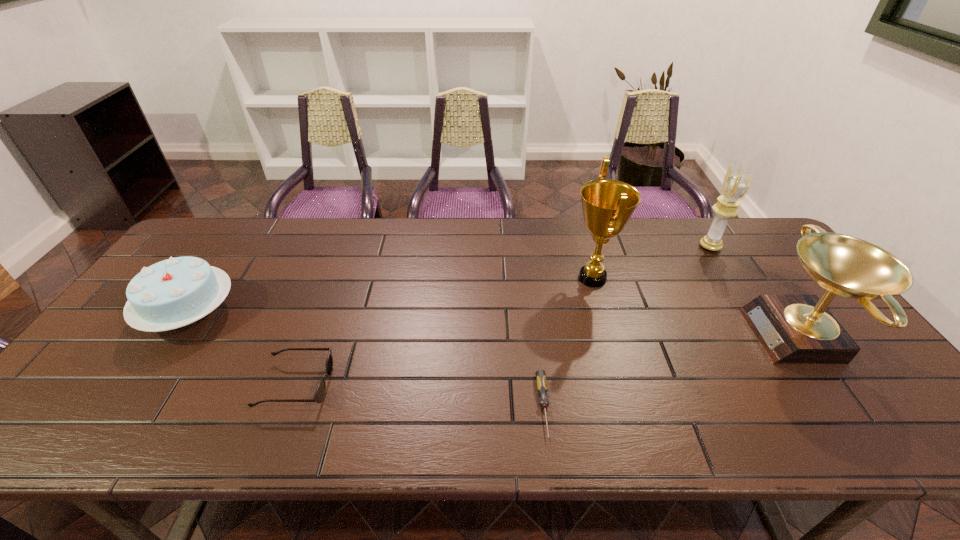
The height and width of the screenshot is (540, 960). I want to click on object that is at the right edge, so click(x=792, y=329).

In the image, there is a desktop. In order to click on vacant space at the far edge in this screenshot , I will do `click(621, 251)`.

This screenshot has width=960, height=540. In order to click on vacant space at the near edge of the desktop in this screenshot , I will do `click(636, 437)`.

Where is `vacant region at the right edge of the desktop`? vacant region at the right edge of the desktop is located at coordinates click(788, 293).

This screenshot has height=540, width=960. In the image, there is a desktop. In order to click on vacant space at the far left corner in this screenshot , I will do 204,240.

The height and width of the screenshot is (540, 960). Identify the location of vacant space at the far right corner of the desktop. (728, 227).

Image resolution: width=960 pixels, height=540 pixels. I want to click on free spot between the sunglasses and the farthest award, so click(x=503, y=316).

This screenshot has height=540, width=960. In order to click on free space between the fourth tallest object and the second object from left to right in this screenshot , I will do `click(243, 349)`.

This screenshot has width=960, height=540. I want to click on free space between the third object from right to left and the birthday cake, so click(391, 296).

This screenshot has height=540, width=960. I want to click on vacant area that lies between the shortest object and the birthday cake, so click(x=367, y=360).